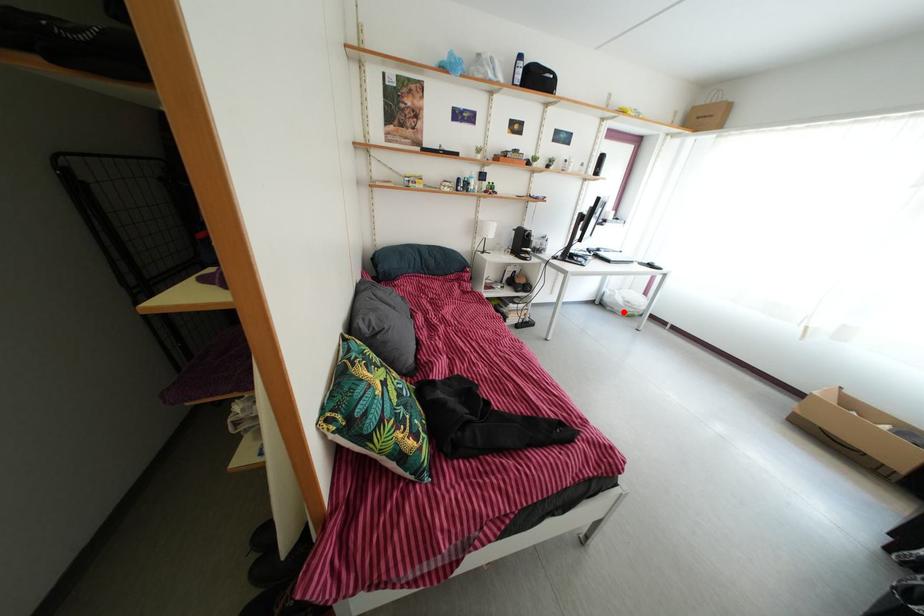
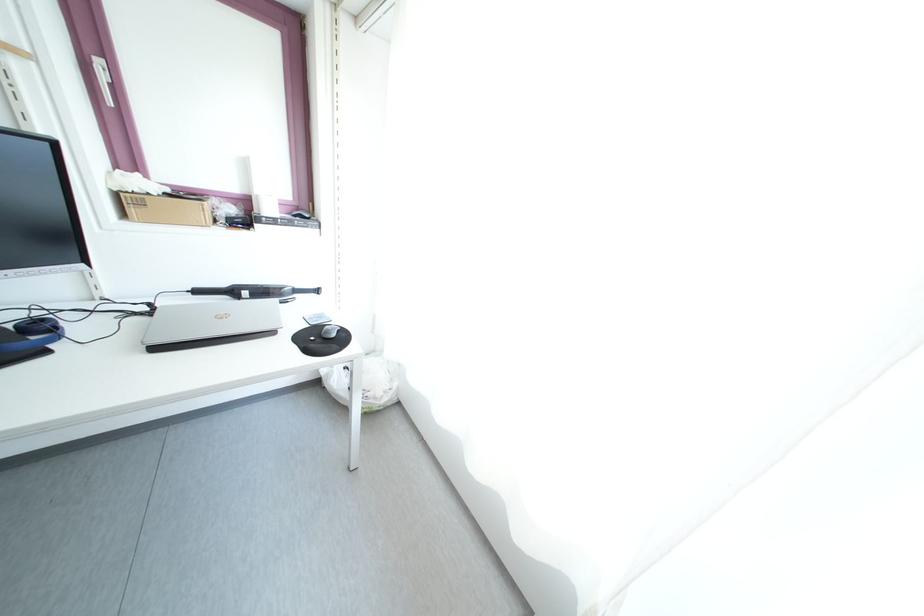
Question: A red point is marked in image1. In image2, is the corresponding 3D point closer to the camera or farther? Reply with the corresponding letter.

Choices:
 (A) The corresponding 3D point is closer.
 (B) The corresponding 3D point is farther.

Answer: (B)